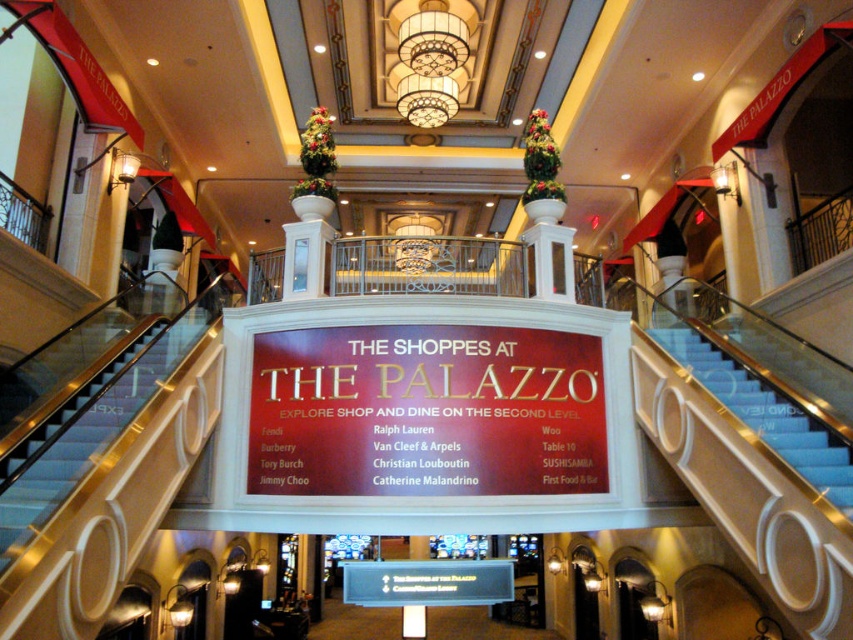
Question: Which object is closer to the camera taking this photo?

Choices:
 (A) blue carpeted stairs at center
 (B) metallic blue stairs at left

Answer: (B)

Question: Where is shiny gold sign at center located in relation to blue carpeted stairs at center in the image?

Choices:
 (A) left
 (B) right

Answer: (A)

Question: Among these points, which one is farthest from the camera?

Choices:
 (A) (729, 392)
 (B) (73, 474)
 (C) (534, 458)

Answer: (A)

Question: Which point is farther to the camera?

Choices:
 (A) shiny gold sign at center
 (B) blue carpeted stairs at center

Answer: (A)

Question: Is shiny gold sign at center thinner than blue carpeted stairs at center?

Choices:
 (A) yes
 (B) no

Answer: (B)

Question: Where is shiny gold sign at center located in relation to metallic blue stairs at left in the image?

Choices:
 (A) above
 (B) below

Answer: (B)